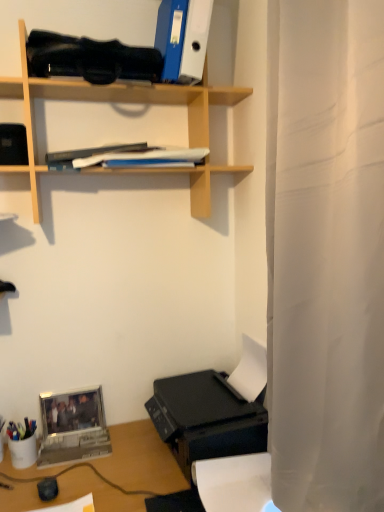
Question: Based on their positions, is wooden shelf at upper center located to the left or right of metallic silver laptop at lower left?

Choices:
 (A) right
 (B) left

Answer: (A)

Question: Considering the positions of point (211, 99) and point (81, 455), is point (211, 99) closer or farther from the camera than point (81, 455)?

Choices:
 (A) closer
 (B) farther

Answer: (B)

Question: Considering the real-world distances, which object is closest to the black plastic printer at lower right?

Choices:
 (A) blue matte folder at upper center
 (B) wooden shelf at upper center
 (C) metallic silver laptop at lower left
 (D) multicolored plastic pen holder at lower left
 (E) blue matte book at upper center

Answer: (C)

Question: Estimate the real-world distances between objects in this image. Which object is closer to the black plastic printer at lower right?

Choices:
 (A) multicolored plastic pen holder at lower left
 (B) white fabric shower curtain at right
 (C) metallic silver laptop at lower left
 (D) wooden shelf at upper center
 (E) blue matte folder at upper center

Answer: (C)